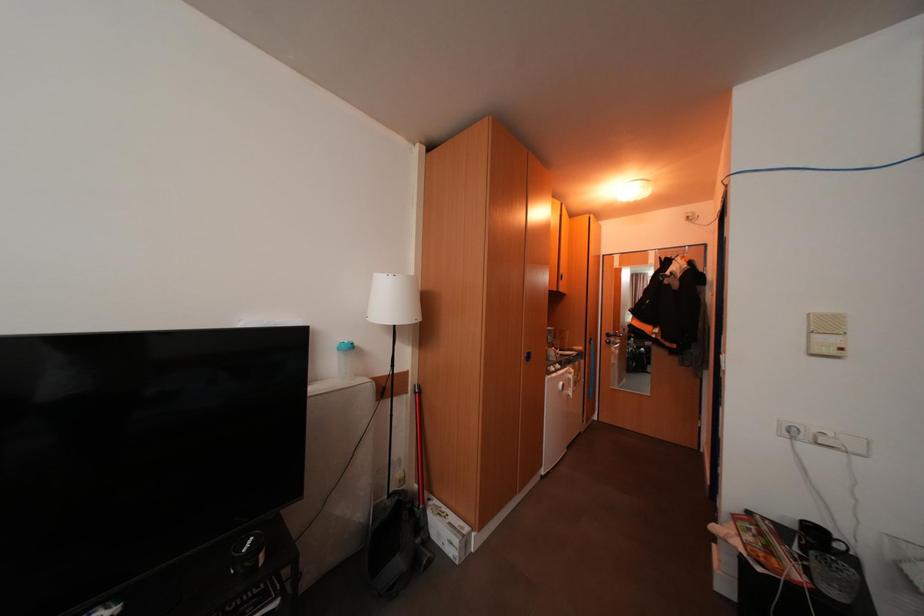
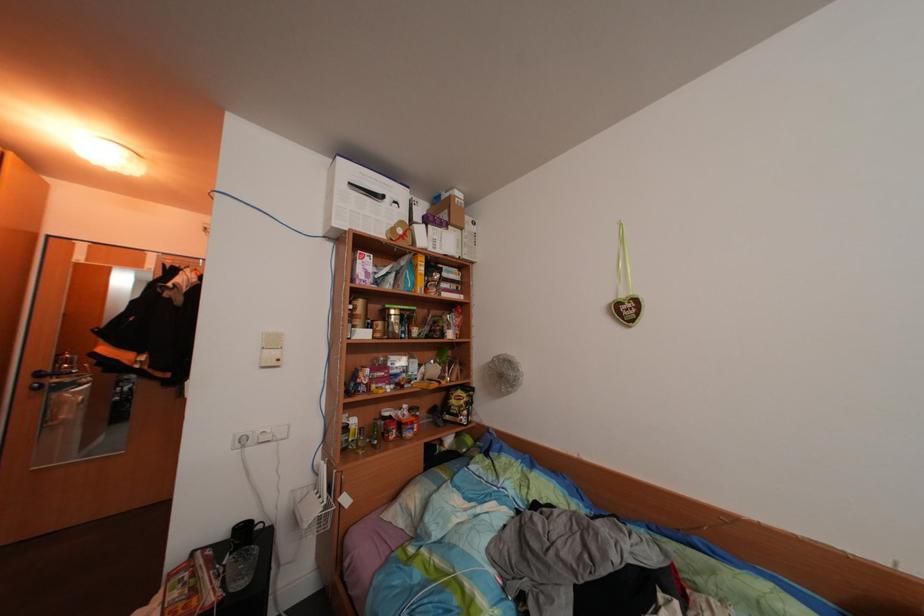
Question: The camera is either moving clockwise (left) or counter-clockwise (right) around the object. The first image is from the beginning of the video and the second image is from the end. Is the camera moving left or right when shooting the video?

Choices:
 (A) Left
 (B) Right

Answer: (A)